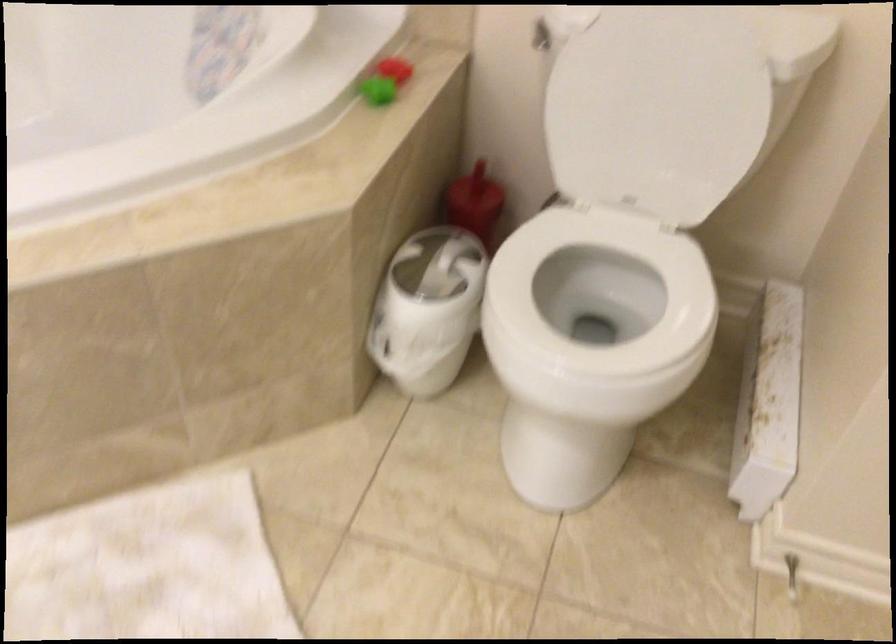
The width and height of the screenshot is (896, 644). What do you see at coordinates (392, 357) in the screenshot? I see `a small trash can handle` at bounding box center [392, 357].